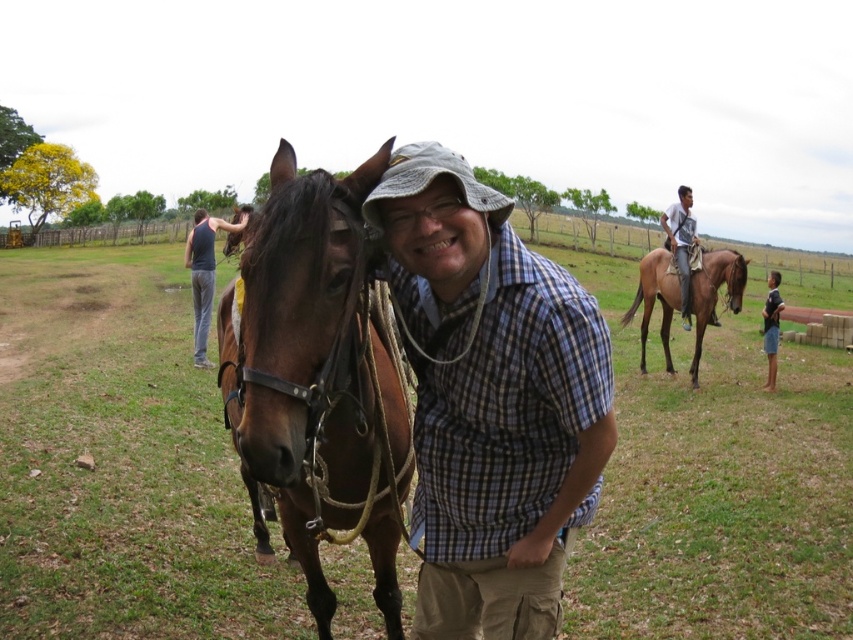
You are a photographer taking a picture of the matte plaid shirt at center and the brown leather horse at center. Which object should be in focus first if you want to ensure both are clear in the photo?

The matte plaid shirt at center should be in focus first because it is positioned over the brown leather horse at center, meaning it is closer to the camera.

You are standing at the point with coordinates point (497, 620) and want to walk towards the point with coordinates point (772, 355). Will you walk forward or backward?

Since point (497, 620) is in front of point (772, 355), you would need to walk backward to move towards point (772, 355).